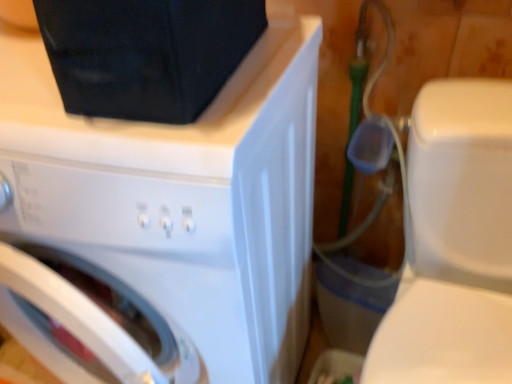
Question: Can you confirm if white glossy washing machine at upper left is positioned to the left of white glossy toilet at right?

Choices:
 (A) no
 (B) yes

Answer: (B)

Question: From the image's perspective, is white glossy washing machine at upper left above white glossy toilet at right?

Choices:
 (A) yes
 (B) no

Answer: (A)

Question: Can you confirm if white glossy washing machine at upper left is taller than white glossy toilet at right?

Choices:
 (A) yes
 (B) no

Answer: (A)

Question: Considering the relative positions of white glossy washing machine at upper left and white glossy toilet at right in the image provided, is white glossy washing machine at upper left behind white glossy toilet at right?

Choices:
 (A) no
 (B) yes

Answer: (B)

Question: Would you say white glossy washing machine at upper left contains white glossy toilet at right?

Choices:
 (A) no
 (B) yes

Answer: (A)

Question: From the image's perspective, is white glossy washing machine at upper left located beneath white glossy toilet at right?

Choices:
 (A) yes
 (B) no

Answer: (B)

Question: Is white glossy toilet at right touching white glossy washing machine at upper left?

Choices:
 (A) yes
 (B) no

Answer: (B)

Question: Considering the relative sizes of white glossy toilet at right and white glossy washing machine at upper left in the image provided, is white glossy toilet at right bigger than white glossy washing machine at upper left?

Choices:
 (A) no
 (B) yes

Answer: (A)

Question: Would you say white glossy toilet at right is outside white glossy washing machine at upper left?

Choices:
 (A) no
 (B) yes

Answer: (B)

Question: Is white glossy toilet at right turned away from white glossy washing machine at upper left?

Choices:
 (A) yes
 (B) no

Answer: (B)

Question: Can you confirm if white glossy toilet at right is shorter than white glossy washing machine at upper left?

Choices:
 (A) no
 (B) yes

Answer: (B)

Question: From the image's perspective, is white glossy toilet at right above white glossy washing machine at upper left?

Choices:
 (A) yes
 (B) no

Answer: (B)

Question: Is white glossy washing machine at upper left taller or shorter than white glossy toilet at right?

Choices:
 (A) tall
 (B) short

Answer: (A)